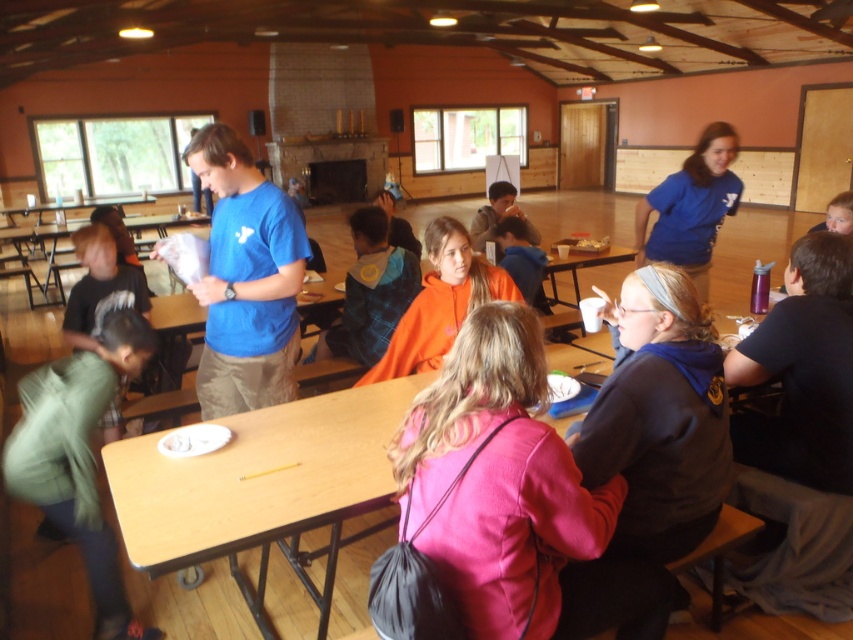
You are organizing a small event and need to decide where to place a new decorative item. The green cotton pants at lower left and the flannel shirt at center are already in the scene. Which object should you place the new item next to if you want it to be in a less crowded area?

The green cotton pants at lower left occupies less space than flannel shirt at center, so placing the new item next to the green cotton pants at lower left would be better as it has more available space.

You are standing at the entrance of the room and want to locate the pink fabric jacket at center. According to the coordinates provided, in which general direction should you look to find it?

The pink fabric jacket at center is located at coordinates point (497, 481), which means it is positioned towards the right side of the room and slightly above the center point. Since you are at the entrance, you should look towards the right side of the room to find it.

You are organizing a photo shoot in this room and need to position a camera on a tripod. The camera requires a minimum height of 1.2 meters to capture the blue cotton shirt at center and green cotton pants at lower left clearly. Given their heights, will the camera setup meet the required height?

The blue cotton shirt at center has a lesser height compared to green cotton pants at lower left. Since the camera requires a minimum height of 1.2 meters, and the blue cotton shirt is shorter, the camera setup should be adjusted to ensure both are captured clearly, possibly by raising the tripod to accommodate the taller green cotton pants at lower left.